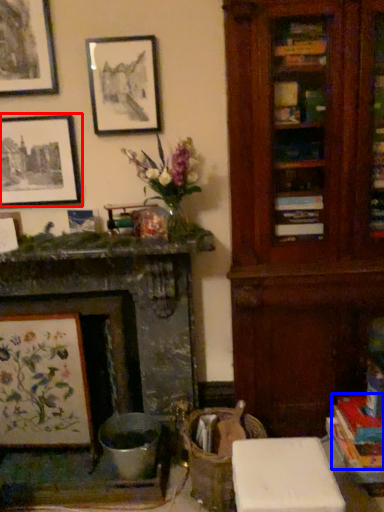
Question: Which object appears closest to the camera in this image, picture frame (highlighted by a red box) or book (highlighted by a blue box)?

Choices:
 (A) picture frame
 (B) book

Answer: (B)